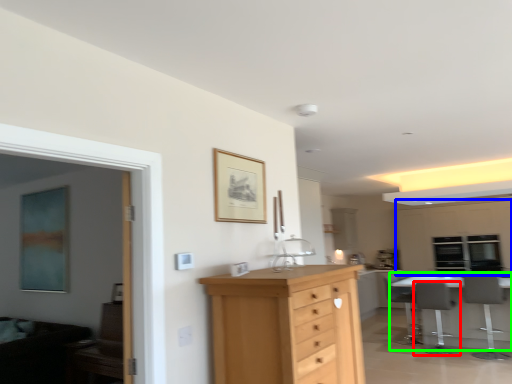
Question: Which is farther away from chair (highlighted by a red box)? cabinetry (highlighted by a blue box) or table (highlighted by a green box)?

Choices:
 (A) cabinetry
 (B) table

Answer: (A)